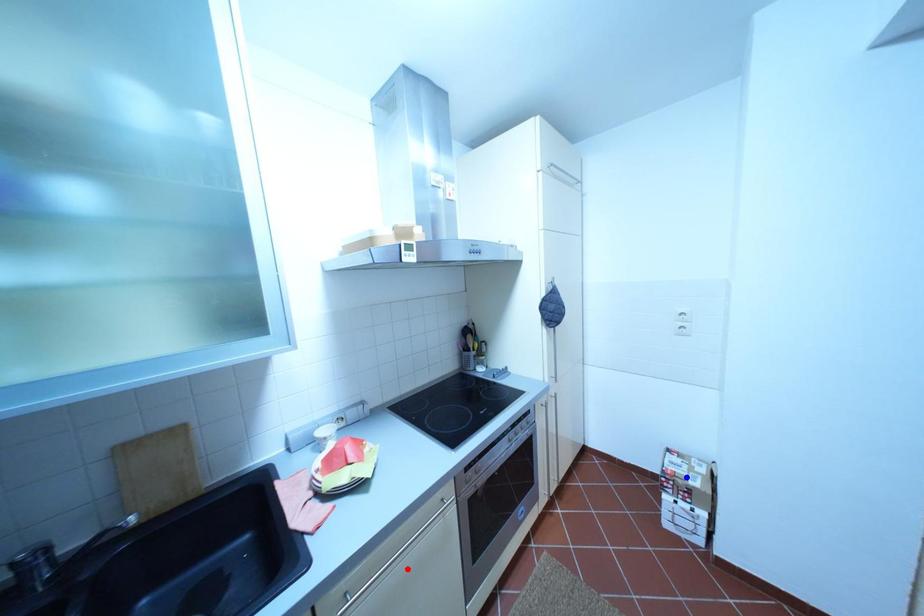
Question: Which of the two points in the image is closer to the camera?

Choices:
 (A) Blue point is closer.
 (B) Red point is closer.

Answer: (B)